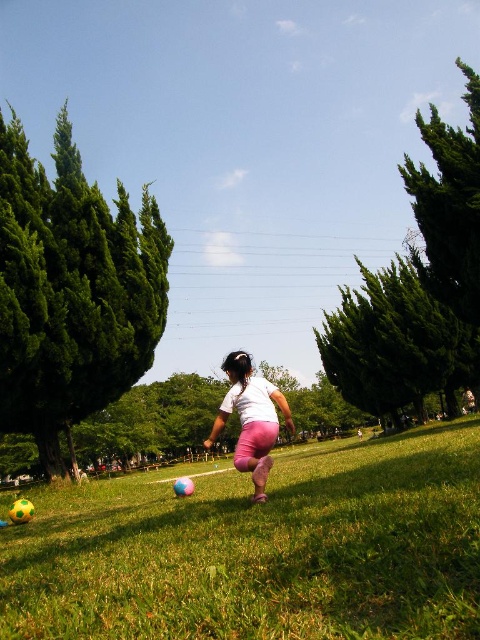
Is green grassy field at center below white matte shirt at center?

Actually, green grassy field at center is above white matte shirt at center.

Between green grassy field at center and white matte shirt at center, which one is positioned lower?

white matte shirt at center is below.

Between point (331, 481) and point (245, 355), which one is positioned behind?

The point (331, 481) is behind.

Where is `green grassy field at center`? This screenshot has width=480, height=640. green grassy field at center is located at coordinates (262, 550).